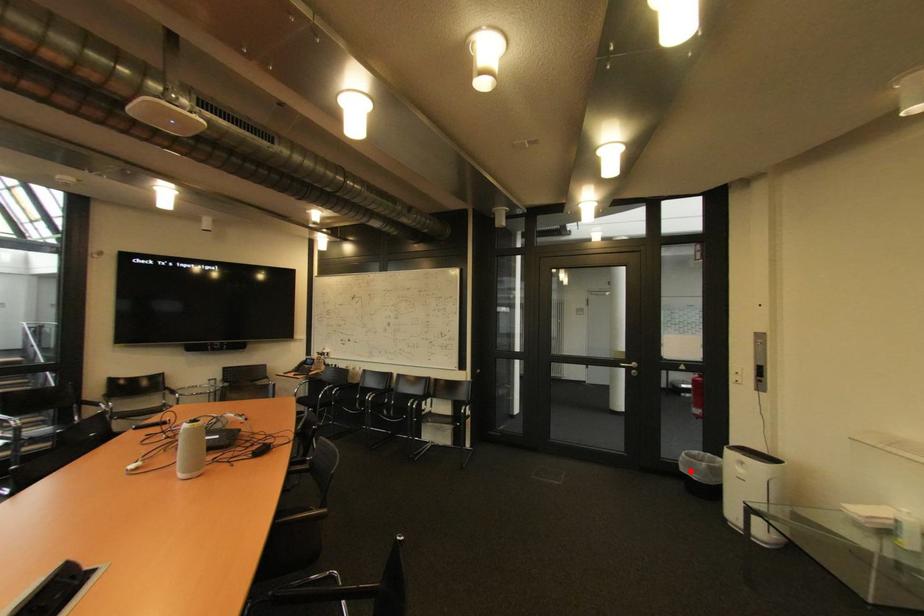
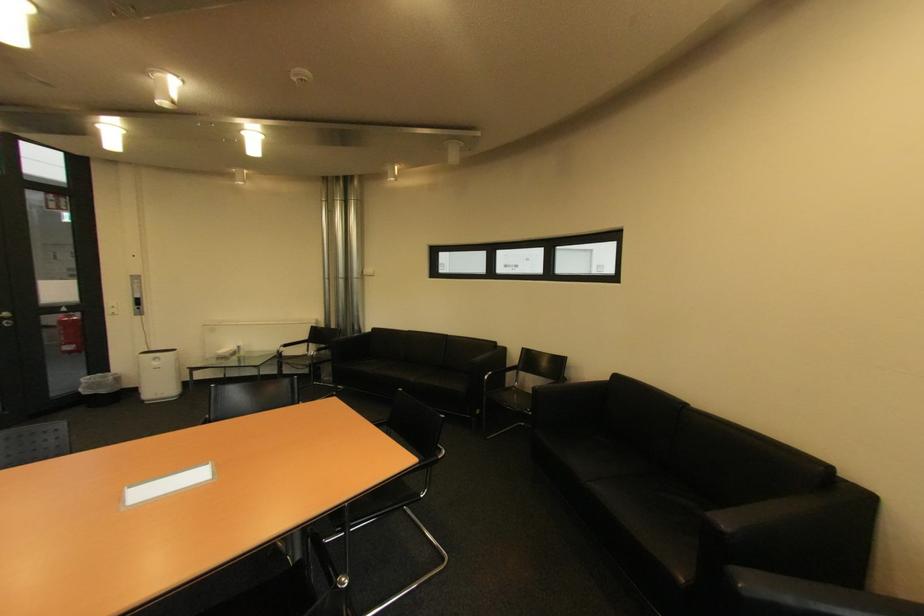
Where in the second image is the point corresponding to the highlighted location from the first image?

(94, 394)